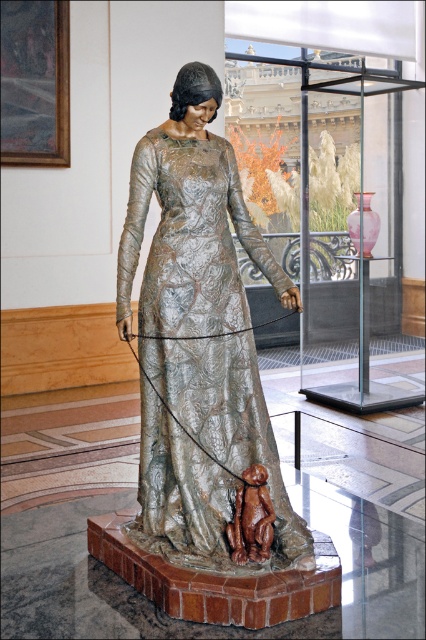
You are an art student observing the sculpture. You notice the shiny silver dress at center and the brown clay monkey at lower center. Which object do you think is larger in size?

The shiny silver dress at center is bigger than brown clay monkey at lower center.

You are an art conservator examining the sculpture. You need to place a protective barrier around the shiny silver dress at center. Where exactly should you position it based on the coordinates provided?

The shiny silver dress at center is located at point coordinates (204, 307), so the protective barrier should be positioned precisely at those coordinates to ensure it covers the dress effectively.

You are an art curator planning to install a spotlight on the shiny silver dress at center and the brown clay monkey at lower center. Which object should you place the spotlight to the right of to highlight both?

The brown clay monkey at lower center should have the spotlight placed to its right since the shiny silver dress at center is positioned to the left of it.